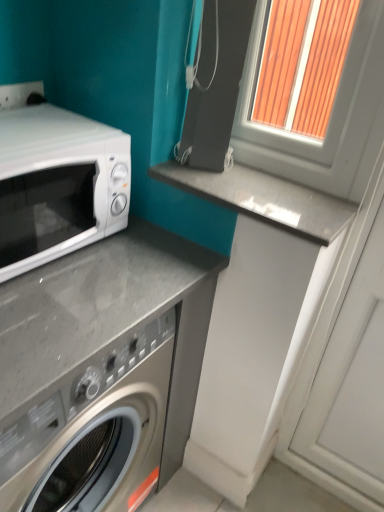
What is the approximate height of white plastic window frame at upper right?

white plastic window frame at upper right is 17.51 inches tall.

The width and height of the screenshot is (384, 512). Describe the element at coordinates (264, 199) in the screenshot. I see `gray polished stone counter top at center` at that location.

Find the location of a particular element. white plastic window frame at upper right is located at coordinates (335, 100).

Is white glossy microwave at left at the back of gray polished stone counter top at center?

No, gray polished stone counter top at center is not facing away from white glossy microwave at left.

Is gray polished stone counter top at center situated inside white glossy microwave at left or outside?

gray polished stone counter top at center is not inside white glossy microwave at left, it's outside.

From the picture: Which is more to the right, gray polished stone counter top at center or white glossy microwave at left?

gray polished stone counter top at center is more to the right.

From the image's perspective, which is above, gray polished stone counter top at center or white glossy microwave at left?

From the image's view, gray polished stone counter top at center is above.

Is white glossy microwave at left beside gray polished stone counter top at center?

No, white glossy microwave at left is not touching gray polished stone counter top at center.

This screenshot has height=512, width=384. What are the coordinates of `counter top on the right of white glossy microwave at left` in the screenshot? It's located at coord(264,199).

Which point is more forward, (x=49, y=127) or (x=152, y=174)?

The point (x=49, y=127) is more forward.

Is white glossy microwave at left smaller than gray polished stone counter top at center?

No, white glossy microwave at left is not smaller than gray polished stone counter top at center.

From the image's perspective, is white plastic window frame at upper right located beneath white glossy microwave at left?

No.

In terms of width, does white plastic window frame at upper right look wider or thinner when compared to white glossy microwave at left?

white plastic window frame at upper right is thinner than white glossy microwave at left.

Between white plastic window frame at upper right and white glossy microwave at left, which one is positioned behind?

white plastic window frame at upper right is more distant.

Identify the location of window frame on the right of the gray polished stone counter top at center. This screenshot has width=384, height=512. (335, 100).

In the scene shown: From a real-world perspective, which object rests below the other?

gray polished stone counter top at center, from a real-world perspective.

Between white plastic window frame at upper right and gray polished stone counter top at center, which one appears on the left side from the viewer's perspective?

gray polished stone counter top at center is more to the left.

From a real-world perspective, is gray polished stone counter top at center positioned above or below white plastic window frame at upper right?

In terms of real-world spatial position, gray polished stone counter top at center is below white plastic window frame at upper right.

Measure the distance between gray polished stone counter top at center and white plastic window frame at upper right.

gray polished stone counter top at center is 8.29 inches from white plastic window frame at upper right.

Is white plastic window frame at upper right a part of gray polished stone counter top at center?

No, white plastic window frame at upper right is not inside gray polished stone counter top at center.

Is gray polished stone counter top at center aimed at white plastic window frame at upper right?

No.

At what (x,y) coordinates should I click in order to perform the action: click on microwave oven that appears on the left of white plastic window frame at upper right. Please return your answer as a coordinate pair (x, y). The width and height of the screenshot is (384, 512). Looking at the image, I should click on (58, 185).

Considering the sizes of white glossy microwave at left and white plastic window frame at upper right in the image, is white glossy microwave at left wider or thinner than white plastic window frame at upper right?

In the image, white glossy microwave at left appears to be wider than white plastic window frame at upper right.

From the image's perspective, is white glossy microwave at left over white plastic window frame at upper right?

No, from the image's perspective, white glossy microwave at left is not on top of white plastic window frame at upper right.

Which object is further away from the camera, white glossy microwave at left or white plastic window frame at upper right?

white plastic window frame at upper right is more distant.

I want to click on counter top lying on the right of white glossy microwave at left, so click(x=264, y=199).

Locate an element on the screen. microwave oven below the gray polished stone counter top at center (from the image's perspective) is located at coordinates (58, 185).

Which object lies further to the anchor point white plastic window frame at upper right, white glossy microwave at left or gray polished stone counter top at center?

Based on the image, white glossy microwave at left appears to be further to white plastic window frame at upper right.

From the image, which object appears to be farther from gray polished stone counter top at center, white plastic window frame at upper right or white glossy microwave at left?

The object further to gray polished stone counter top at center is white glossy microwave at left.

From the image, which object appears to be nearer to gray polished stone counter top at center, white glossy microwave at left or white plastic window frame at upper right?

Based on the image, white plastic window frame at upper right appears to be nearer to gray polished stone counter top at center.

Considering their positions, is gray polished stone counter top at center positioned further to white plastic window frame at upper right than white glossy microwave at left?

white glossy microwave at left lies further to white plastic window frame at upper right than the other object.

Considering their positions, is white plastic window frame at upper right positioned further to white glossy microwave at left than gray polished stone counter top at center?

white plastic window frame at upper right is further to white glossy microwave at left.

When comparing their distances from white glossy microwave at left, does gray polished stone counter top at center or white plastic window frame at upper right seem further?

The object further to white glossy microwave at left is white plastic window frame at upper right.

Image resolution: width=384 pixels, height=512 pixels. What are the coordinates of `counter top between white glossy microwave at left and white plastic window frame at upper right in the horizontal direction` in the screenshot? It's located at 264,199.